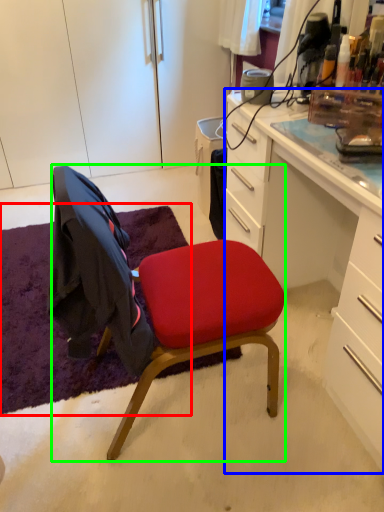
Question: Based on their relative distances, which object is nearer to mat (highlighted by a red box)? Choose from desk (highlighted by a blue box) and chair (highlighted by a green box).

Choices:
 (A) desk
 (B) chair

Answer: (B)